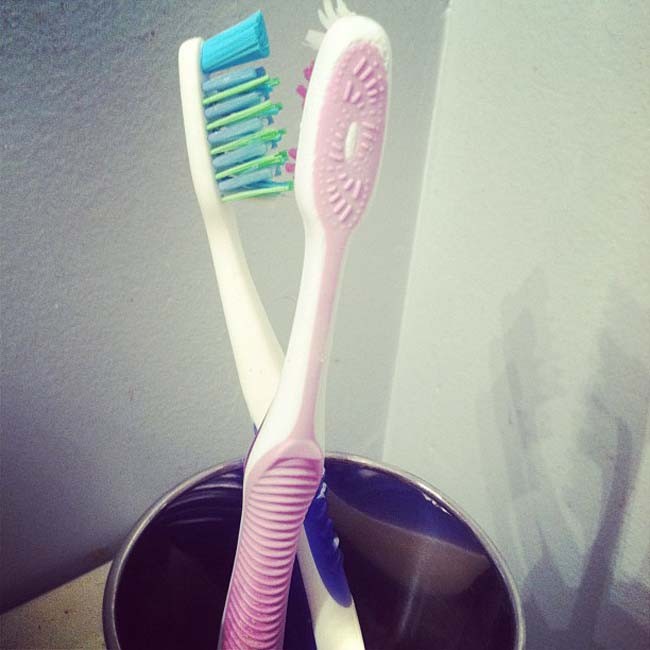
What are the coordinates of `corner of the room` in the screenshot? It's located at (417, 270).